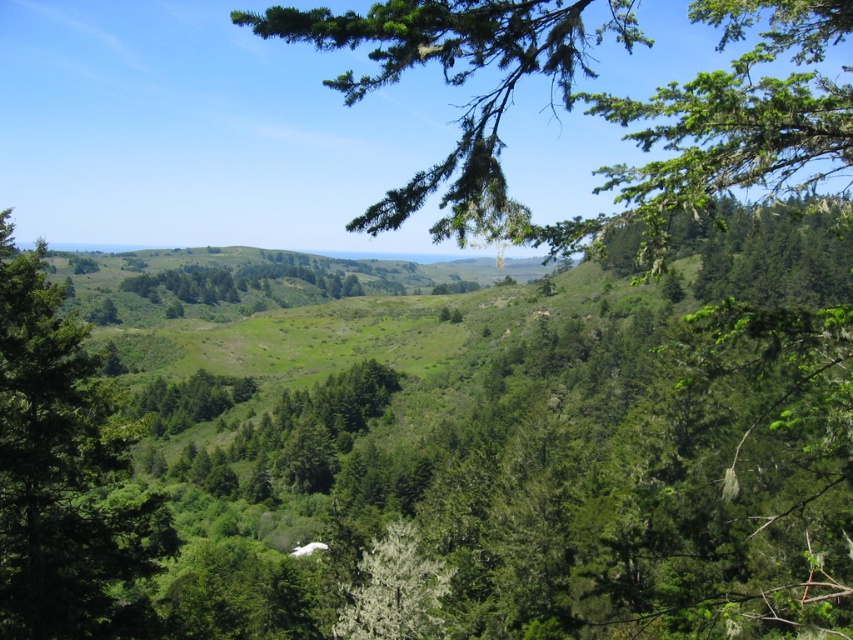
You are standing in the landscape and want to take a photo of the white fluffy tree at center without the green leafy branch at upper center blocking the view. Which direction should you move to avoid the branch?

The green leafy branch at upper center is above the white fluffy tree at center, so you should move downward to avoid the branch blocking the view.

You are standing in the serene landscape described and notice a green leafy branch at upper center. Can you determine its exact position using the coordinate system provided?

The green leafy branch at upper center is located at point 0.158 in the x coordinate and 0.696 in the y coordinate.